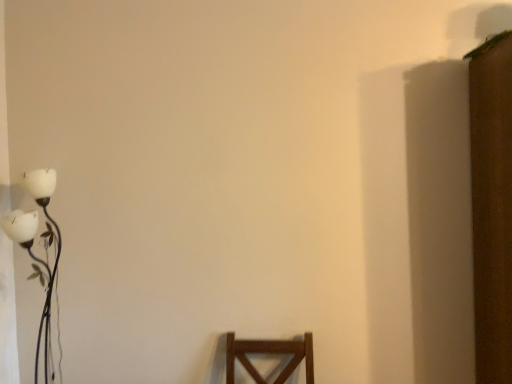
The height and width of the screenshot is (384, 512). In order to click on white glossy lamp at left in this screenshot , I will do `click(38, 257)`.

The height and width of the screenshot is (384, 512). Describe the element at coordinates (38, 257) in the screenshot. I see `white glossy lamp at left` at that location.

Where is `white glossy lamp at left`? The height and width of the screenshot is (384, 512). white glossy lamp at left is located at coordinates (38, 257).